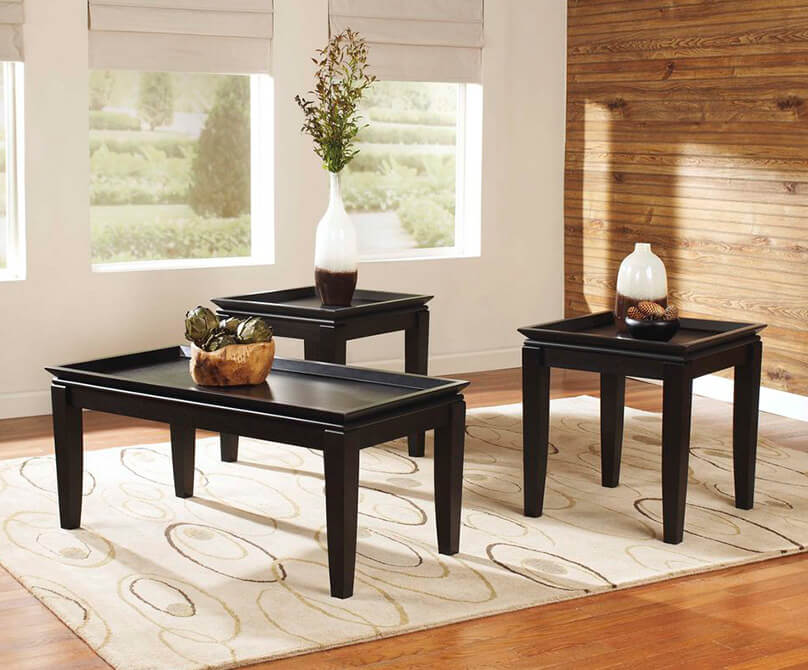
At what (x,y) coordinates should I click in order to perform the action: click on bowl. Please return your answer as a coordinate pair (x, y). This screenshot has height=670, width=808. Looking at the image, I should click on (211, 372).